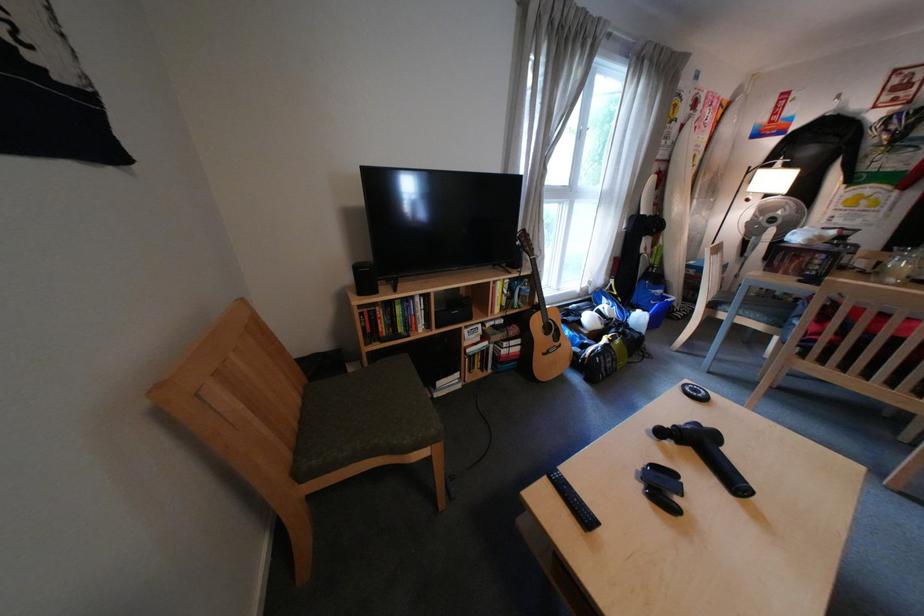
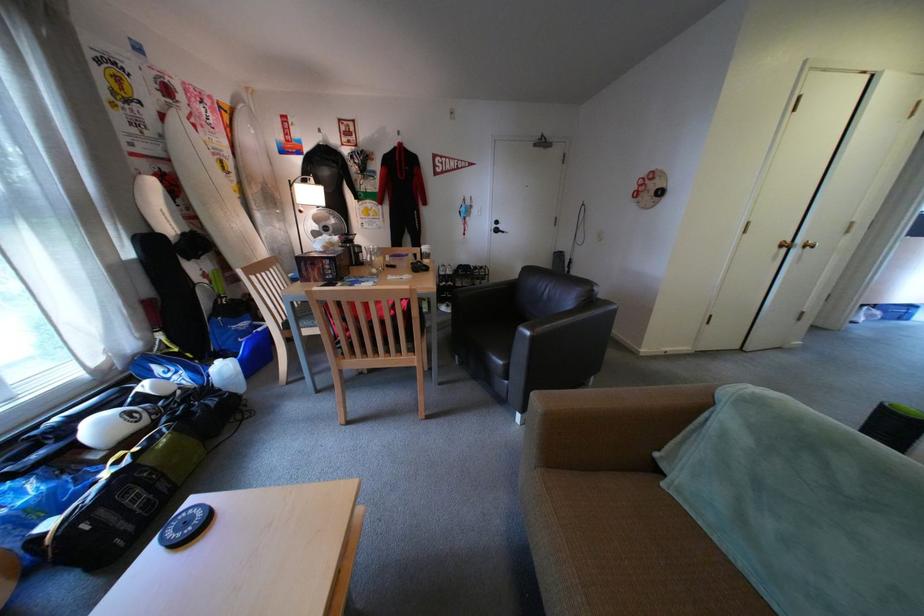
In the second image, find the point that corresponds to (x=723, y=374) in the first image.

(333, 392)